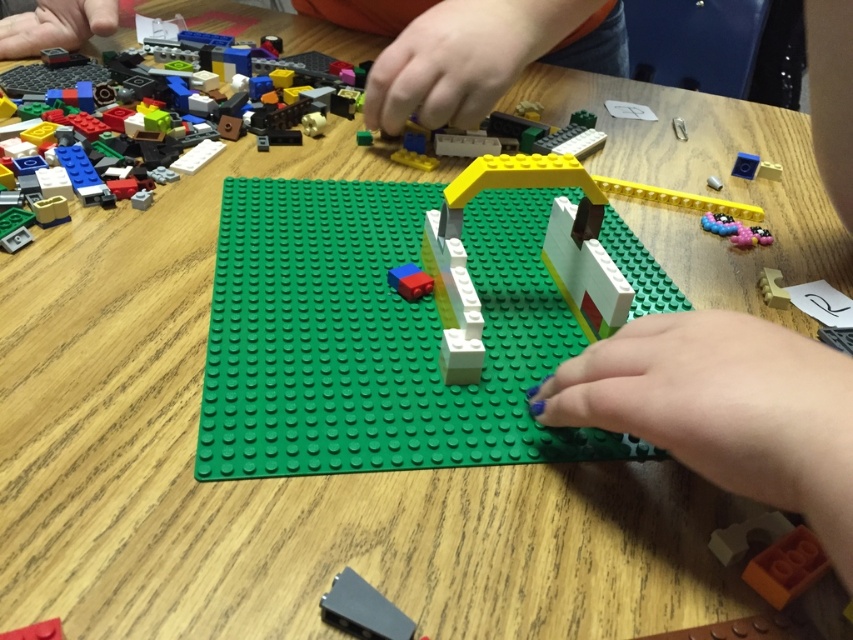
Question: Which point is closer to the camera?

Choices:
 (A) white matte house at center
 (B) matte blue brick at center

Answer: (A)

Question: Estimate the real-world distances between objects in this image. Which object is closer to the translucent yellow plastic at upper center?

Choices:
 (A) matte blue brick at center
 (B) white matte house at center
 (C) pastel plastic toy at right

Answer: (C)

Question: Is translucent plastic bricks at upper left to the right of matte blue brick at center from the viewer's perspective?

Choices:
 (A) yes
 (B) no

Answer: (B)

Question: Is translucent yellow plastic at upper center to the left of black plastic piece at lower center from the viewer's perspective?

Choices:
 (A) no
 (B) yes

Answer: (A)

Question: Considering the relative positions of white matte house at center and black plastic piece at lower center in the image provided, where is white matte house at center located with respect to black plastic piece at lower center?

Choices:
 (A) above
 (B) below

Answer: (A)

Question: Estimate the real-world distances between objects in this image. Which object is closer to the translucent yellow plastic at upper center?

Choices:
 (A) matte blue brick at center
 (B) pastel plastic toy at right
 (C) black plastic piece at lower center
 (D) white matte house at center

Answer: (B)